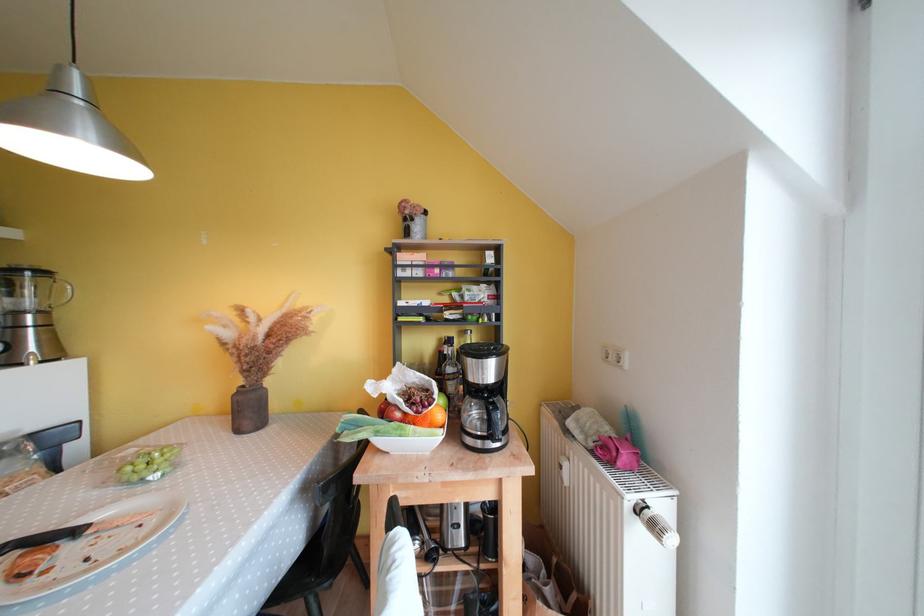
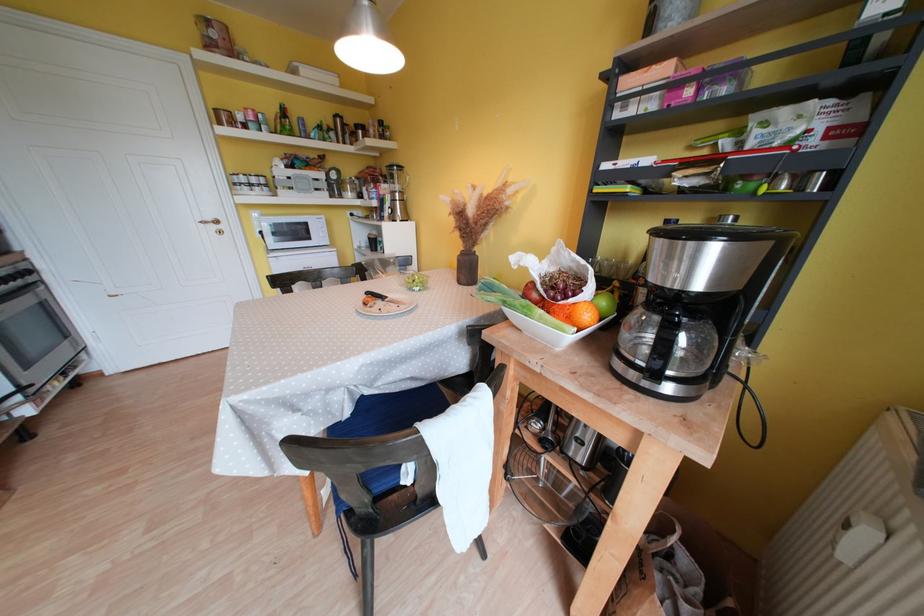
The point at (405, 418) is marked in the first image. Where is the corresponding point in the second image?

(541, 299)